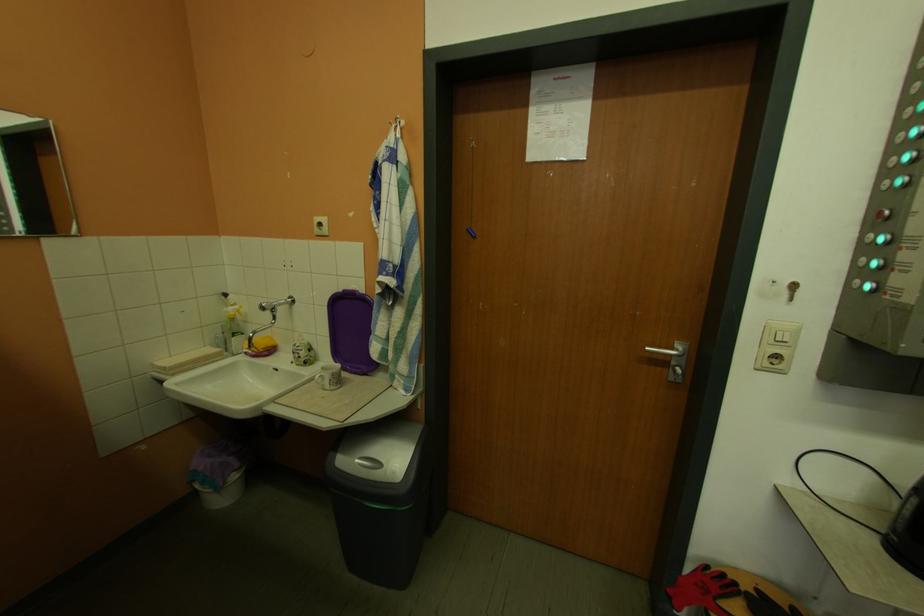
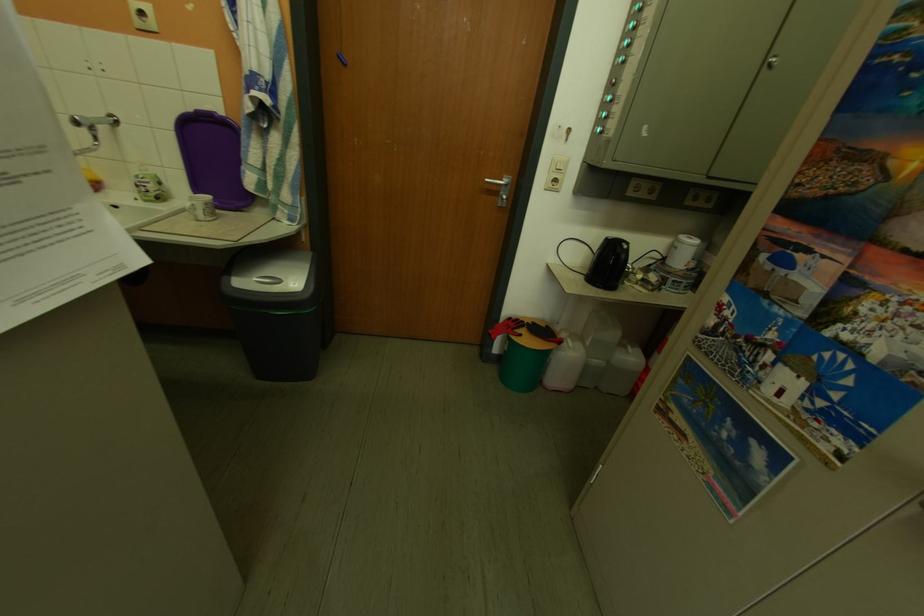
Locate, in the second image, the point that corresponds to point (310, 347) in the first image.

(154, 179)